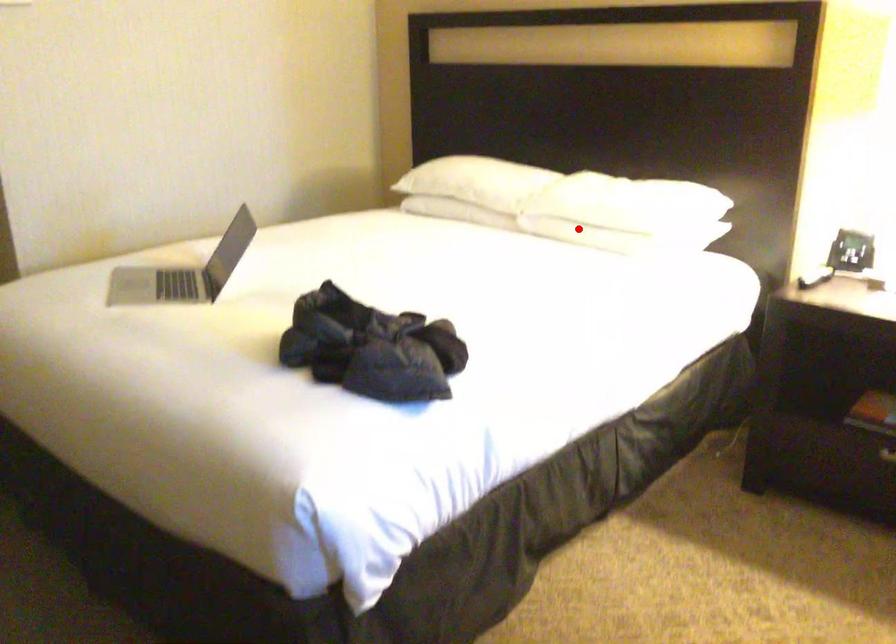
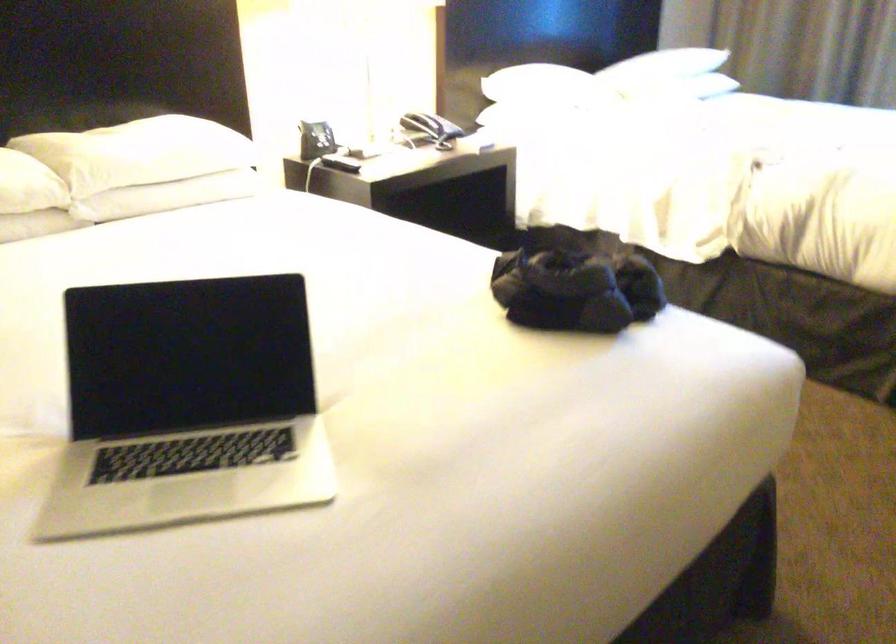
Question: I am providing you with two images of the same scene from different viewpoints. In image1, a red point is highlighted. Considering the same 3D point in image2, which of the following is correct?

Choices:
 (A) It is closer
 (B) It is farther

Answer: (A)